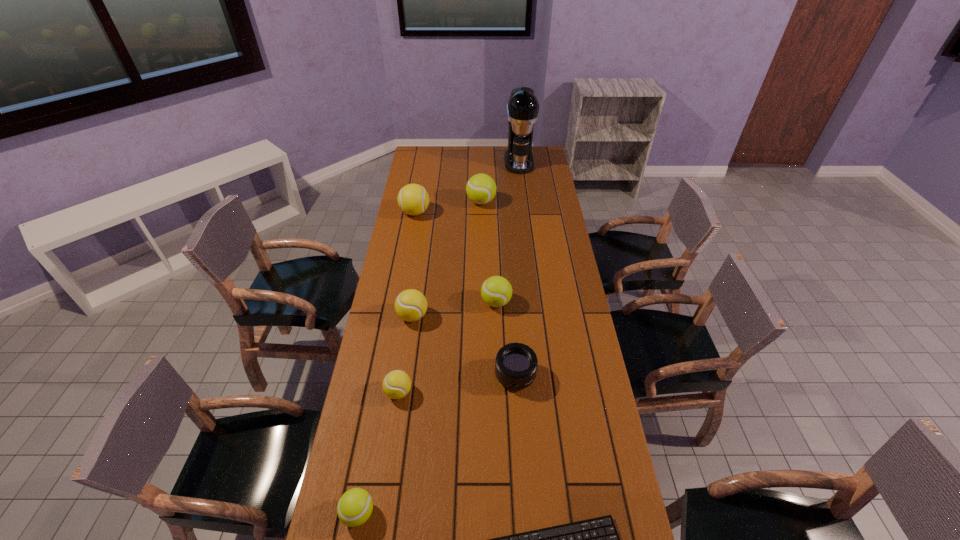
Identify which yellow tennis ball is the closest to the second smallest green tennis ball. Please provide its 2D coordinates. Your answer should be formatted as a tuple, i.e. [(x, y)], where the tuple contains the x and y coordinates of a point satisfying the conditions above.

[(410, 305)]

In order to click on yellow tennis ball that stands as the second closest to the nearest yellow tennis ball in this screenshot , I will do point(413,199).

I want to click on free point that satisfies the following two spatial constraints: 1. on the back side of the farthest yellow tennis ball; 2. on the right side of the biggest green tennis ball, so click(x=417, y=202).

Where is `vacant space that satisfies the following two spatial constraints: 1. on the back side of the second biggest yellow tennis ball; 2. on the right side of the smallest yellow tennis ball`? The height and width of the screenshot is (540, 960). vacant space that satisfies the following two spatial constraints: 1. on the back side of the second biggest yellow tennis ball; 2. on the right side of the smallest yellow tennis ball is located at coordinates (410, 316).